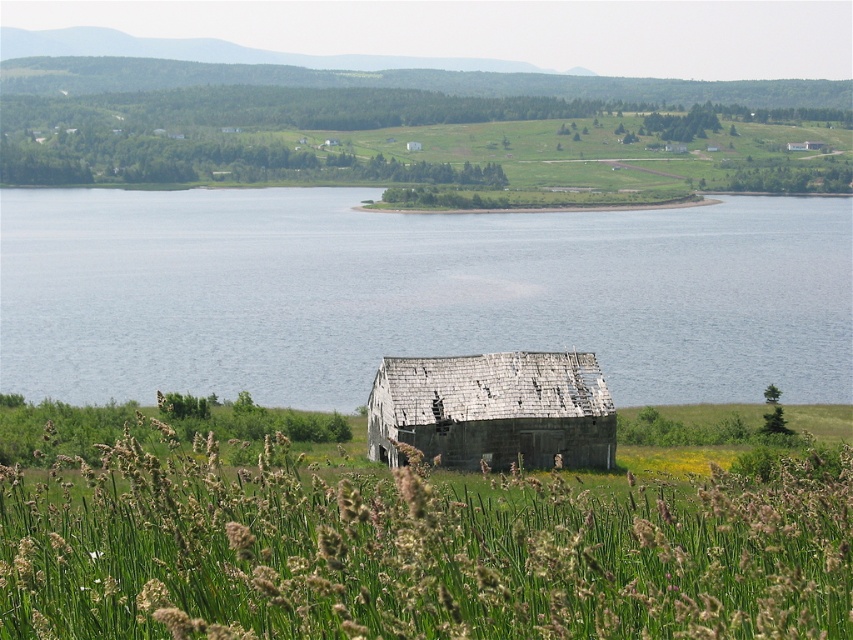
Based on the photo, does blue water at center have a greater width compared to green grassy at center?

Yes, blue water at center is wider than green grassy at center.

Which is behind, point (334, 220) or point (845, 522)?

Positioned behind is point (334, 220).

Between point (744, 355) and point (503, 624), which one is positioned in front?

Point (503, 624)

This screenshot has height=640, width=853. What are the coordinates of `blue water at center` in the screenshot? It's located at (415, 294).

Does green grassy at center appear on the right side of weathered wood hut at center?

No, green grassy at center is not to the right of weathered wood hut at center.

Who is more distant from viewer, (317,620) or (592,449)?

The point (592,449) is behind.

The width and height of the screenshot is (853, 640). Identify the location of green grassy at center. (415, 550).

Is blue water at center smaller than weathered wood hut at center?

Actually, blue water at center might be larger than weathered wood hut at center.

The width and height of the screenshot is (853, 640). What are the coordinates of `blue water at center` in the screenshot? It's located at point(415,294).